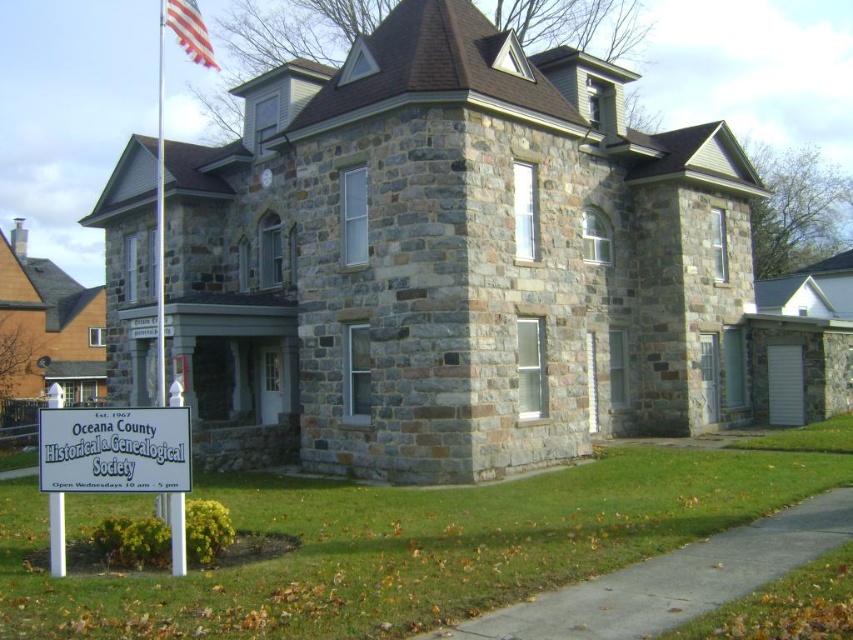
Question: In this image, where is white plastic sign at lower left located relative to american flag at upper left?

Choices:
 (A) right
 (B) left

Answer: (A)

Question: Which point is farther to the camera?

Choices:
 (A) (206, 60)
 (B) (376, 515)
 (C) (163, 493)
 (D) (62, 464)

Answer: (A)

Question: Can you confirm if green grass at lower center is wider than white plastic sign at lower left?

Choices:
 (A) yes
 (B) no

Answer: (A)

Question: Which object appears farthest from the camera in this image?

Choices:
 (A) american flag at upper left
 (B) white plastic sign at lower left
 (C) metallic silver flag pole at upper left
 (D) green grass at lower center

Answer: (A)

Question: Can you confirm if white plastic sign at lower left is smaller than metallic silver flag pole at upper left?

Choices:
 (A) yes
 (B) no

Answer: (A)

Question: Based on their relative distances, which object is farther from the metallic silver flag pole at upper left?

Choices:
 (A) american flag at upper left
 (B) white plastic sign at lower left
 (C) green grass at lower center

Answer: (B)